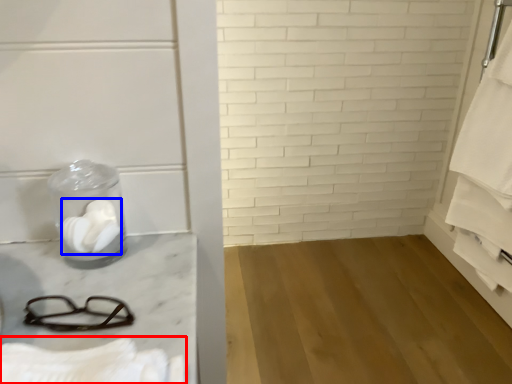
Question: Which of the following is the closest to the observer, bath towel (highlighted by a red box) or toilet paper (highlighted by a blue box)?

Choices:
 (A) bath towel
 (B) toilet paper

Answer: (A)